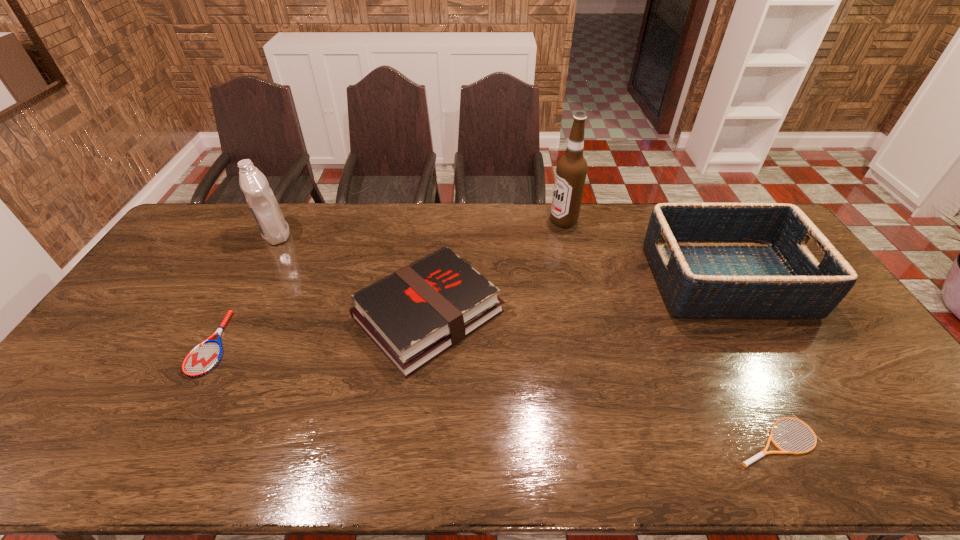
I want to click on free area in between the hardback book and the detergent, so [x=352, y=274].

Identify the location of vacant area that lies between the fourth shortest object and the tallest object. The image size is (960, 540). (644, 251).

The width and height of the screenshot is (960, 540). In order to click on empty location between the basket and the alcohol in this screenshot , I will do `click(644, 251)`.

The width and height of the screenshot is (960, 540). What are the coordinates of `free space between the shorter tennis racket and the fourth object from left to right` in the screenshot? It's located at (669, 330).

Find the location of a particular element. The image size is (960, 540). free area in between the nearest object and the second tallest object is located at coordinates (526, 338).

The width and height of the screenshot is (960, 540). Identify the location of free spot between the right tennis racket and the fourth object from left to right. (669, 330).

Identify the location of object identified as the third closest to the basket. The height and width of the screenshot is (540, 960). (415, 314).

Identify which object is the third nearest to the fourth object from left to right. Please provide its 2D coordinates. Your answer should be formatted as a tuple, i.e. [(x, y)], where the tuple contains the x and y coordinates of a point satisfying the conditions above.

[(761, 454)]

Locate an element on the screen. The image size is (960, 540). free region that satisfies the following two spatial constraints: 1. on the back side of the third object from left to right; 2. on the left side of the left tennis racket is located at coordinates tap(228, 314).

Where is `free point that satisfies the following two spatial constraints: 1. on the label of the basket; 2. on the right side of the fourth object from left to right`? Image resolution: width=960 pixels, height=540 pixels. free point that satisfies the following two spatial constraints: 1. on the label of the basket; 2. on the right side of the fourth object from left to right is located at coordinates (577, 280).